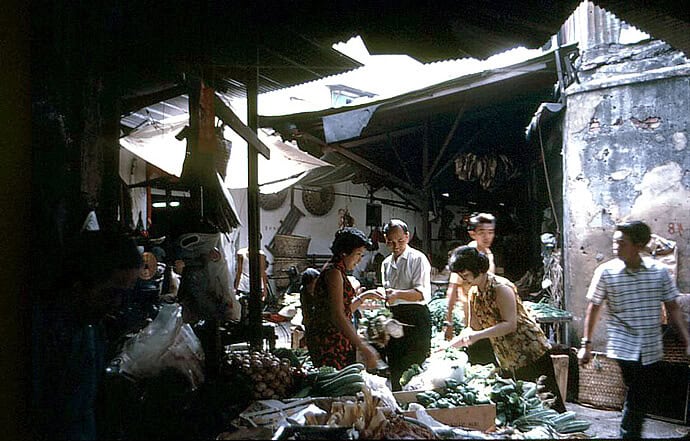
Where is `discoloured and chipped stone wall`? Image resolution: width=690 pixels, height=441 pixels. discoloured and chipped stone wall is located at coordinates (633, 184).